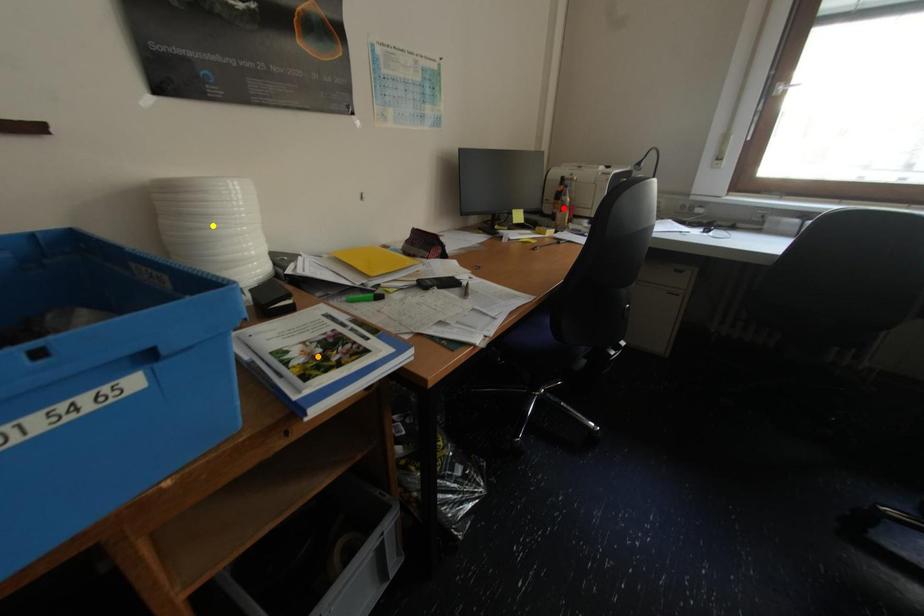
Order these from farthest to nearest:
1. yellow point
2. orange point
3. red point

red point → yellow point → orange point